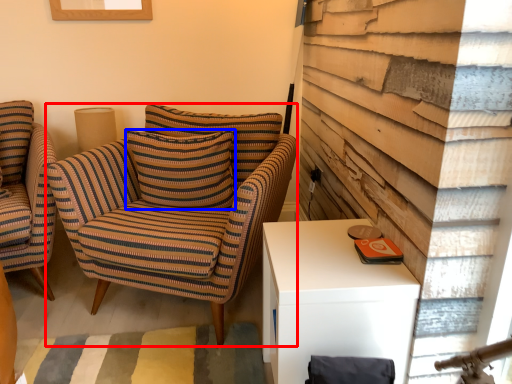
Question: Which point is closer to the camera, chair (highlighted by a red box) or pillow (highlighted by a blue box)?

Choices:
 (A) chair
 (B) pillow

Answer: (A)